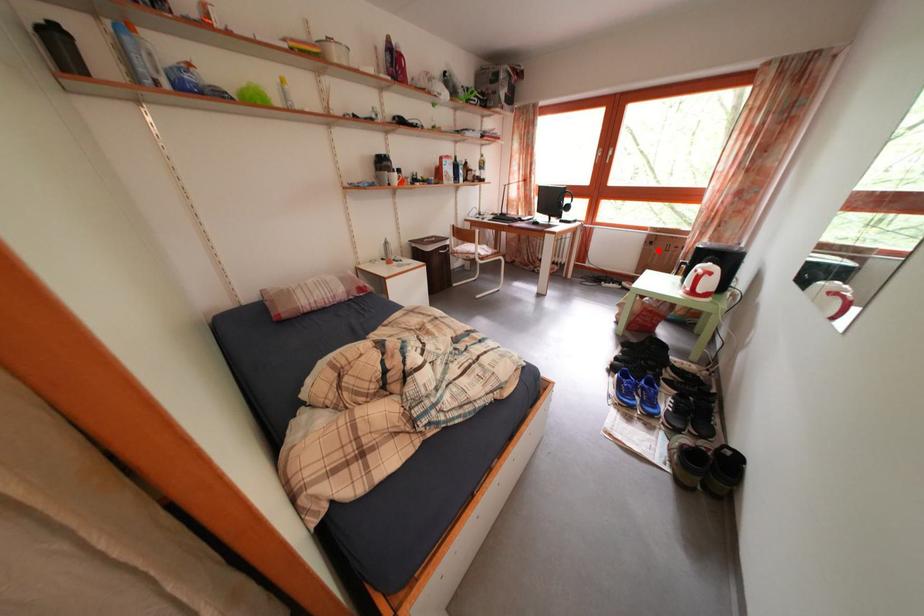
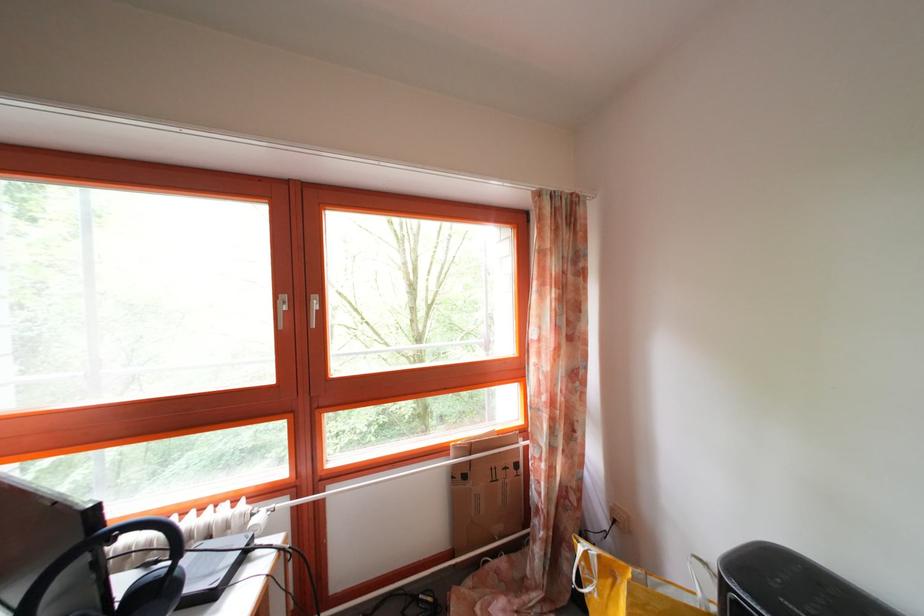
In the second image, find the point that corresponds to the highlighted location in the first image.

(472, 484)